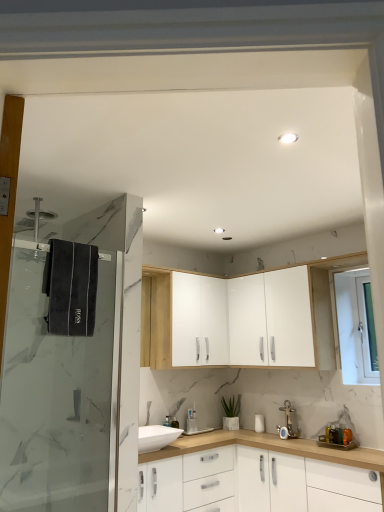
This screenshot has width=384, height=512. In order to click on vacant space behind white glossy light fixture at upper center in this screenshot , I will do pyautogui.click(x=289, y=153).